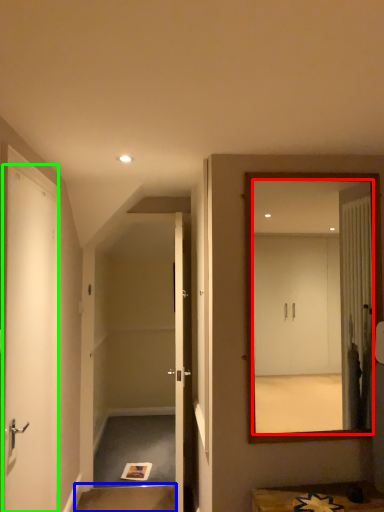
Question: Estimate the real-world distances between objects in this image. Which object is farther from mirror (highlighted by a red box), stair (highlighted by a blue box) or door (highlighted by a green box)?

Choices:
 (A) stair
 (B) door

Answer: (A)